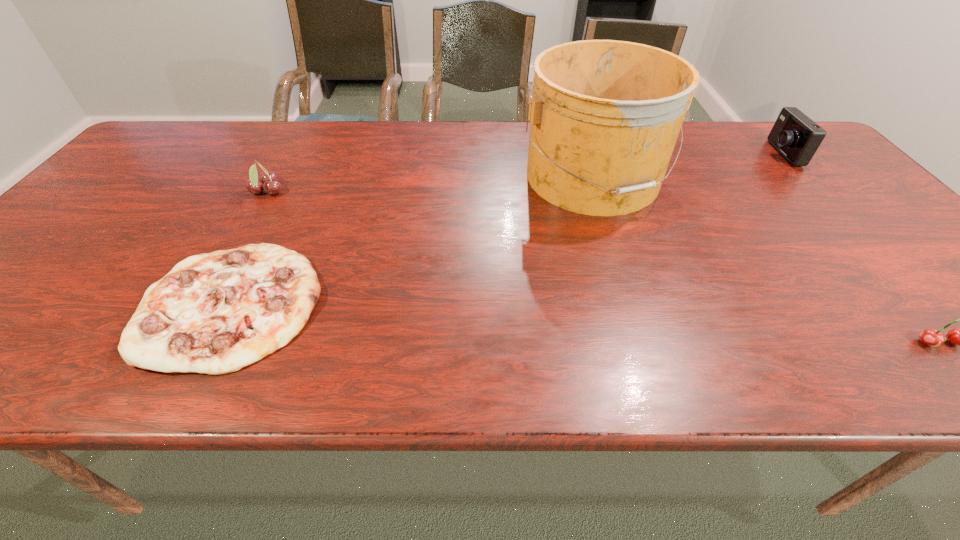
Locate an element on the screen. This screenshot has width=960, height=540. free space between the pizza and the bucket is located at coordinates (413, 240).

What are the coordinates of `free spot between the shortest object and the third object from left to right` in the screenshot? It's located at (413, 240).

I want to click on vacant region between the bucket and the shortest object, so click(413, 240).

Image resolution: width=960 pixels, height=540 pixels. In order to click on free space that is in between the tallest object and the shortest object in this screenshot , I will do `click(413, 240)`.

What are the coordinates of `free space between the pizza and the third object from right to left` in the screenshot? It's located at (413, 240).

This screenshot has width=960, height=540. In order to click on vacant area that lies between the third object from left to right and the shortest object in this screenshot , I will do `click(413, 240)`.

At what (x,y) coordinates should I click in order to perform the action: click on object that can be found as the third closest to the nearer cherry. Please return your answer as a coordinate pair (x, y). Image resolution: width=960 pixels, height=540 pixels. Looking at the image, I should click on (214, 313).

Where is `the fourth closest object to the right cherry`? the fourth closest object to the right cherry is located at coordinates (x=268, y=182).

This screenshot has width=960, height=540. I want to click on free region that satisfies the following two spatial constraints: 1. on the front-facing side of the camera; 2. on the front side of the shortest object, so click(917, 303).